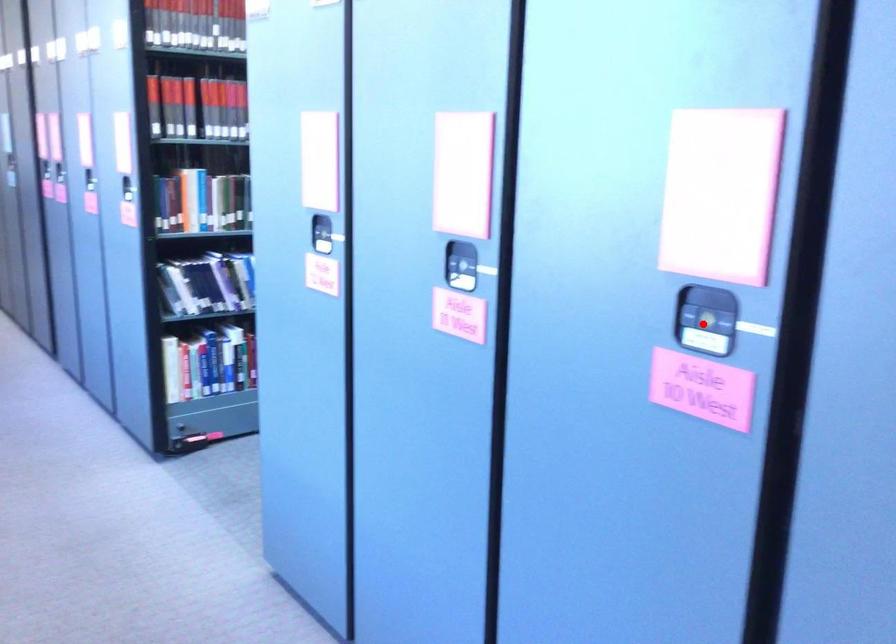
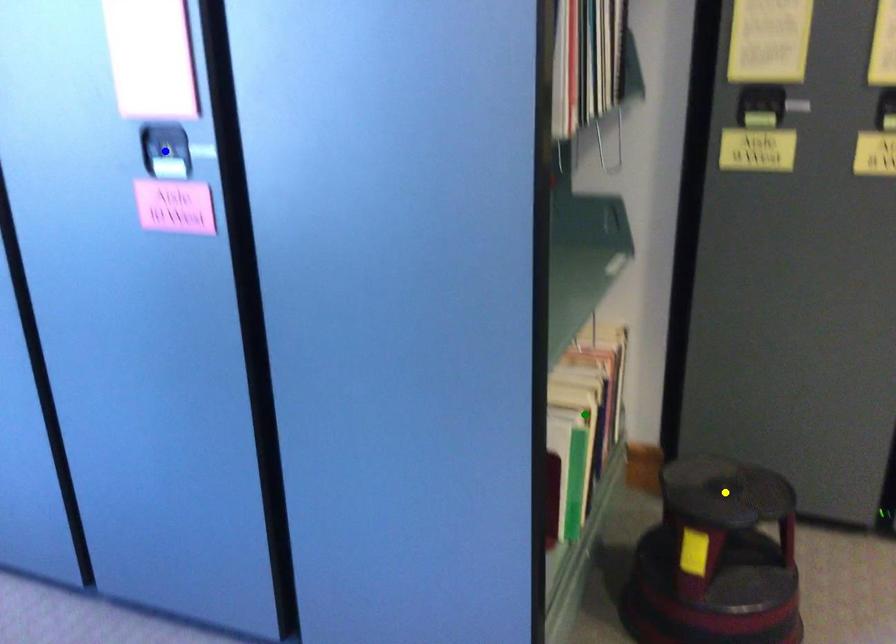
Question: I am providing you with two images of the same scene from different viewpoints. A red point is marked on the first image. You are given multiple points on the second image. Which point in image 2 is actually the same real-world point as the red point in image 1?

Choices:
 (A) green point
 (B) blue point
 (C) yellow point

Answer: (B)